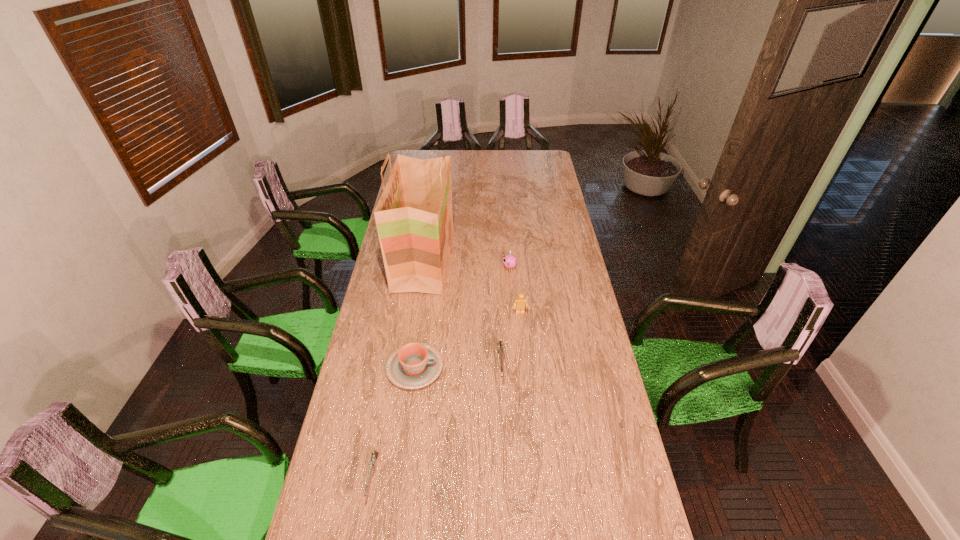
Find the location of a particular element. This screenshot has height=540, width=960. free point between the right pistol and the chinaware is located at coordinates tap(458, 367).

Locate an element on the screen. unoccupied area between the chinaware and the grocery bag is located at coordinates (420, 314).

Select which object appears as the fifth closest to the third farthest object. Please provide its 2D coordinates. Your answer should be formatted as a tuple, i.e. [(x, y)], where the tuple contains the x and y coordinates of a point satisfying the conditions above.

[(374, 455)]

Locate an element on the screen. The height and width of the screenshot is (540, 960). object that is the second closest to the nearer pistol is located at coordinates [500, 346].

Locate an element on the screen. vacant area that satisfies the following two spatial constraints: 1. on the handle side of the chinaware; 2. on the front-facing side of the nearer pistol is located at coordinates (400, 477).

Locate an element on the screen. free space that satisfies the following two spatial constraints: 1. on the face of the cupcake; 2. on the front-facing side of the shortest object is located at coordinates (525, 477).